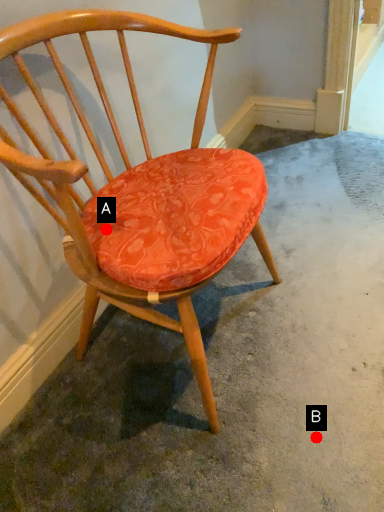
Question: Two points are circled on the image, labeled by A and B beside each circle. Which point is farther to the camera?

Choices:
 (A) A is further
 (B) B is further

Answer: (B)